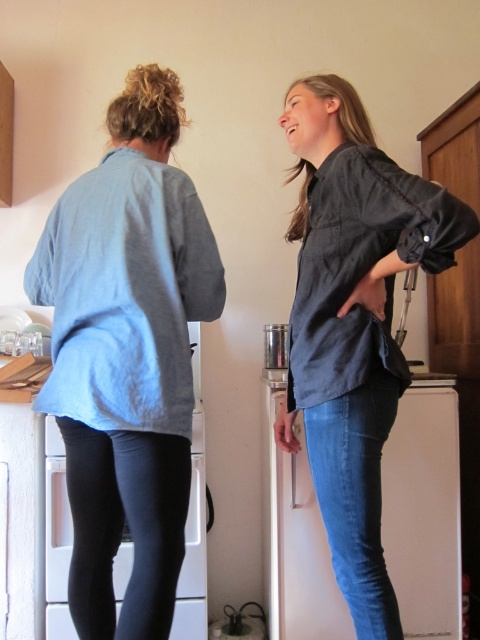
Question: Can you confirm if dark gray linen shirt at center is positioned below black matte leggings at lower left?

Choices:
 (A) no
 (B) yes

Answer: (A)

Question: Can you confirm if light blue cotton shirt at back is positioned below blue denim jeans at lower center?

Choices:
 (A) yes
 (B) no

Answer: (B)

Question: Does dark gray linen shirt at center appear on the right side of black matte leggings at lower left?

Choices:
 (A) no
 (B) yes

Answer: (B)

Question: Which point is farther to the camera?

Choices:
 (A) (346, 628)
 (B) (117, 486)
 (C) (342, 481)

Answer: (A)

Question: Which object is closer to the camera taking this photo?

Choices:
 (A) blue denim jeans at lower center
 (B) black matte leggings at lower left
 (C) light blue cotton shirt at back

Answer: (C)

Question: Which object is farther from the camera taking this photo?

Choices:
 (A) light blue cotton shirt at back
 (B) blue denim jeans at lower center

Answer: (B)